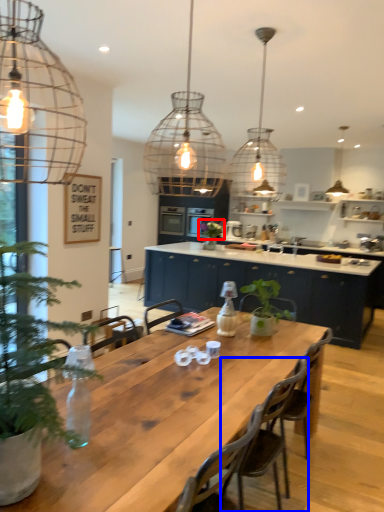
Question: Which of the following is the closest to the observer, plant (highlighted by a red box) or chair (highlighted by a blue box)?

Choices:
 (A) plant
 (B) chair

Answer: (B)